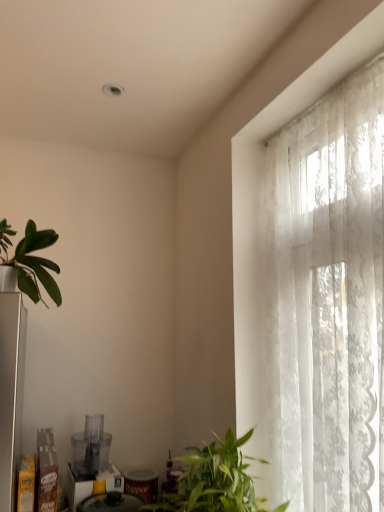
Question: From the image's perspective, is green matte plant at left, positioned as the 1th houseplant in top-to-bottom order, on white lace curtain at right?

Choices:
 (A) yes
 (B) no

Answer: (A)

Question: Is green matte plant at left, the second houseplant when ordered from front to back, far away from white lace curtain at right?

Choices:
 (A) no
 (B) yes

Answer: (A)

Question: Considering the relative sizes of green matte plant at left, the second houseplant when ordered from front to back, and white lace curtain at right in the image provided, is green matte plant at left, the second houseplant when ordered from front to back, bigger than white lace curtain at right?

Choices:
 (A) yes
 (B) no

Answer: (B)

Question: Considering the relative sizes of green matte plant at left, the 1th houseplant from the left, and white lace curtain at right in the image provided, is green matte plant at left, the 1th houseplant from the left, thinner than white lace curtain at right?

Choices:
 (A) no
 (B) yes

Answer: (A)

Question: Is white lace curtain at right surrounded by green matte plant at left, which is the first houseplant from back to front?

Choices:
 (A) no
 (B) yes

Answer: (A)

Question: From the image's perspective, is green matte plant at left, which ranks as the 2th houseplant in right-to-left order, located above or below transparent plastic food processor at lower left, which appears as the first appliance when viewed from the top?

Choices:
 (A) above
 (B) below

Answer: (A)

Question: Considering the relative positions of green matte plant at left, the 1th houseplant from the left, and transparent plastic food processor at lower left, which appears as the first appliance when viewed from the top, in the image provided, is green matte plant at left, the 1th houseplant from the left, to the left or to the right of transparent plastic food processor at lower left, which appears as the first appliance when viewed from the top,?

Choices:
 (A) left
 (B) right

Answer: (A)

Question: Considering the positions of point (48, 286) and point (92, 443), is point (48, 286) closer or farther from the camera than point (92, 443)?

Choices:
 (A) closer
 (B) farther

Answer: (A)

Question: Is green matte plant at left, marked as the second houseplant in a bottom-to-top arrangement, inside the boundaries of transparent plastic food processor at lower left, which is the 2th appliance in bottom-to-top order, or outside?

Choices:
 (A) inside
 (B) outside

Answer: (B)

Question: Would you say transparent plastic food processor at lower left, which appears as the first appliance when viewed from the top, is to the left or to the right of green leafy plant at lower right, marked as the second houseplant in a top-to-bottom arrangement, in the picture?

Choices:
 (A) right
 (B) left

Answer: (B)

Question: In terms of height, does transparent plastic food processor at lower left, which is the 2th appliance in bottom-to-top order, look taller or shorter compared to green leafy plant at lower right, the 1th houseplant viewed from the right?

Choices:
 (A) tall
 (B) short

Answer: (B)

Question: From the image's perspective, is transparent plastic food processor at lower left, which is the 2th appliance in bottom-to-top order, positioned above or below green leafy plant at lower right, the second houseplant in the back-to-front sequence?

Choices:
 (A) above
 (B) below

Answer: (B)

Question: Is transparent plastic food processor at lower left, which appears as the first appliance when viewed from the top, bigger or smaller than green leafy plant at lower right, the 1th houseplant viewed from the right?

Choices:
 (A) big
 (B) small

Answer: (B)

Question: Is transparent plastic food processor at lower left, which is the 2th appliance in bottom-to-top order, in front of or behind green matte plant at left, the 1th houseplant from the left, in the image?

Choices:
 (A) behind
 (B) front

Answer: (A)

Question: Is transparent plastic food processor at lower left, which appears as the first appliance when viewed from the top, situated inside green matte plant at left, which ranks as the 2th houseplant in right-to-left order, or outside?

Choices:
 (A) outside
 (B) inside

Answer: (A)